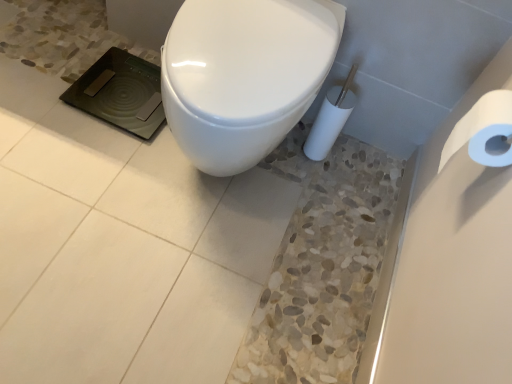
Question: From the image's perspective, is white paper at right beneath white glossy toilet at center?

Choices:
 (A) yes
 (B) no

Answer: (A)

Question: Is white glossy toilet at center inside white paper at right?

Choices:
 (A) yes
 (B) no

Answer: (B)

Question: Can you confirm if white paper at right is taller than white glossy toilet at center?

Choices:
 (A) no
 (B) yes

Answer: (A)

Question: Does white paper at right have a lesser width compared to white glossy toilet at center?

Choices:
 (A) yes
 (B) no

Answer: (A)

Question: Is white paper at right at the left side of white glossy toilet at center?

Choices:
 (A) yes
 (B) no

Answer: (B)

Question: Is white paper at right looking in the opposite direction of white glossy toilet at center?

Choices:
 (A) yes
 (B) no

Answer: (B)

Question: Is white glossy toilet at center facing away from white paper at right?

Choices:
 (A) yes
 (B) no

Answer: (B)

Question: From a real-world perspective, does white glossy toilet at center stand above white paper at right?

Choices:
 (A) yes
 (B) no

Answer: (B)

Question: From a real-world perspective, is white glossy toilet at center positioned under white paper at right based on gravity?

Choices:
 (A) no
 (B) yes

Answer: (B)

Question: Is white glossy toilet at center positioned far away from white paper at right?

Choices:
 (A) yes
 (B) no

Answer: (B)

Question: Could white paper at right be considered to be inside white glossy toilet at center?

Choices:
 (A) yes
 (B) no

Answer: (B)

Question: Can we say white glossy toilet at center lies outside white paper at right?

Choices:
 (A) yes
 (B) no

Answer: (A)

Question: Is white glossy toilet at center wider or thinner than white paper at right?

Choices:
 (A) thin
 (B) wide

Answer: (B)